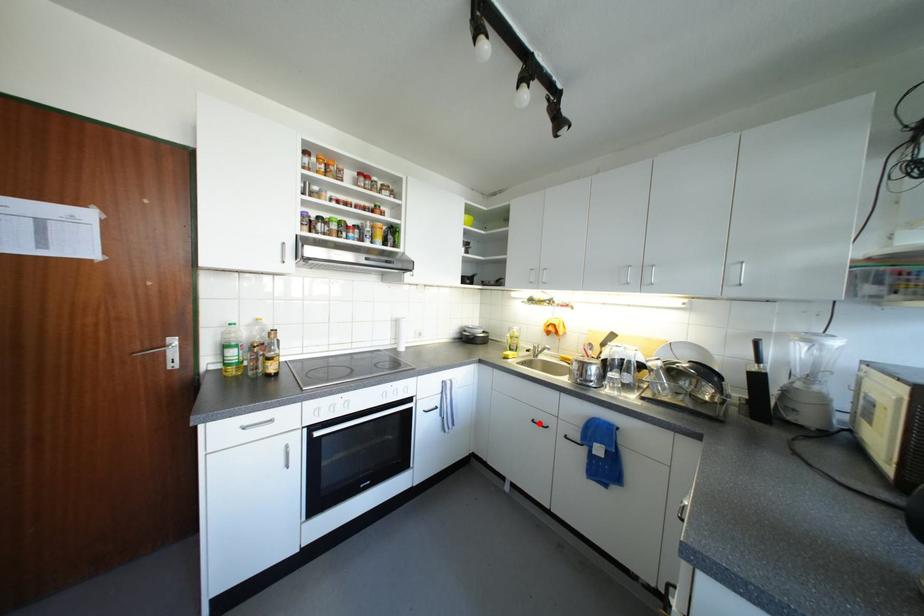
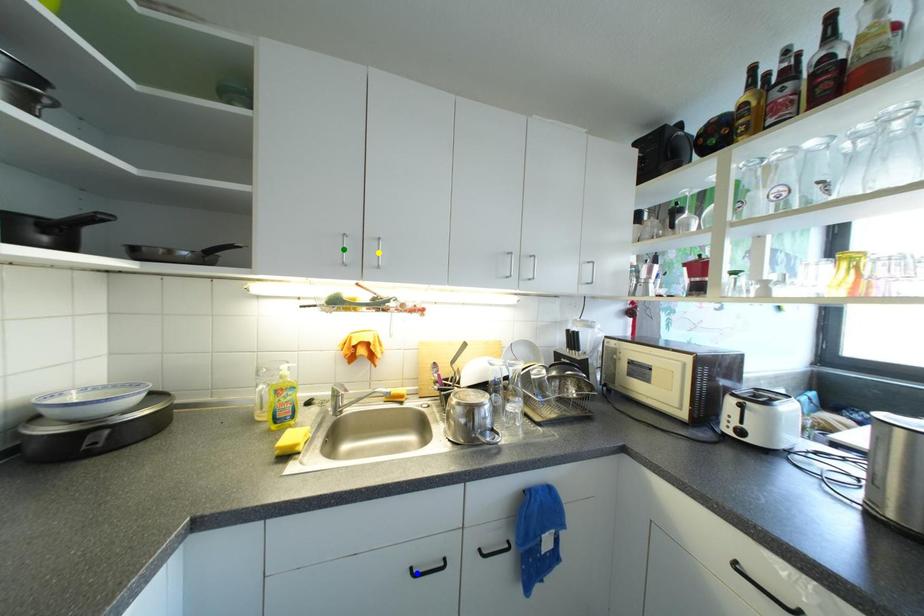
Question: I am providing you with two images of the same scene from different viewpoints. A red point is marked on the first image. You are given multiple points on the second image. Can you choose the point in image 2 that corresponds to the point in image 1?

Choices:
 (A) green point
 (B) blue point
 (C) yellow point

Answer: (B)